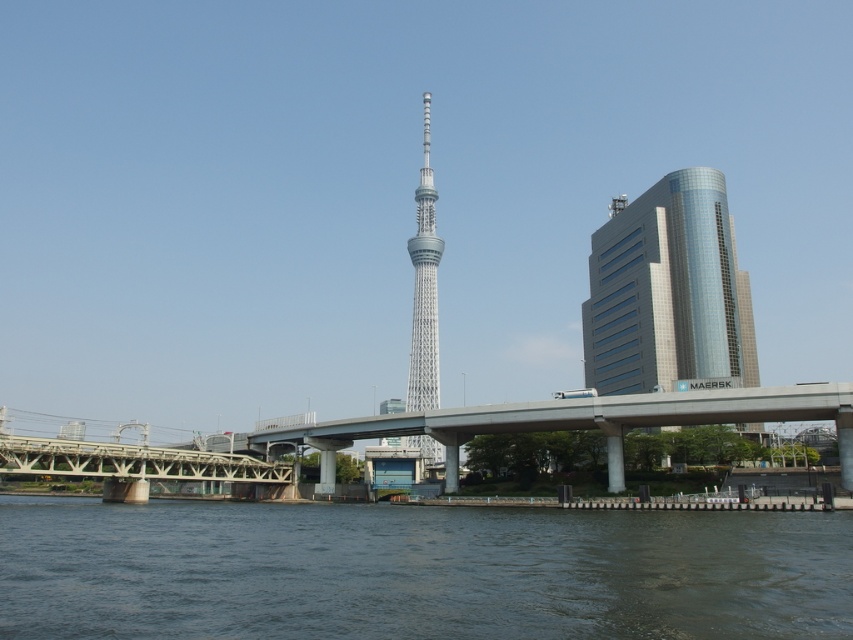
Question: Which is nearer to the dark gray water at lower center?

Choices:
 (A) glassy silver skyscraper at right
 (B) concrete bridge at lower left
 (C) concrete bridge at center
 (D) silver metallic tv tower at center

Answer: (C)

Question: Is dark gray water at lower center to the right of concrete bridge at lower left from the viewer's perspective?

Choices:
 (A) no
 (B) yes

Answer: (B)

Question: Which object is farther from the camera taking this photo?

Choices:
 (A) concrete bridge at lower left
 (B) silver metallic tv tower at center

Answer: (B)

Question: Observing the image, what is the correct spatial positioning of dark gray water at lower center in reference to concrete bridge at lower left?

Choices:
 (A) above
 (B) below

Answer: (A)

Question: Can you confirm if dark gray water at lower center is thinner than concrete bridge at center?

Choices:
 (A) no
 (B) yes

Answer: (B)

Question: Among these objects, which one is farthest from the camera?

Choices:
 (A) glassy silver skyscraper at right
 (B) dark gray water at lower center
 (C) silver metallic tv tower at center

Answer: (C)